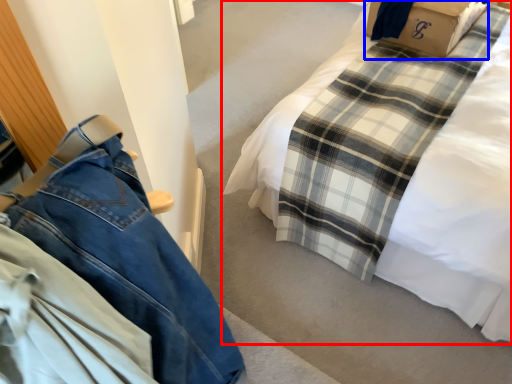
Question: Which of the following is the closest to the observer, bed (highlighted by a red box) or cardboard box (highlighted by a blue box)?

Choices:
 (A) bed
 (B) cardboard box

Answer: (A)